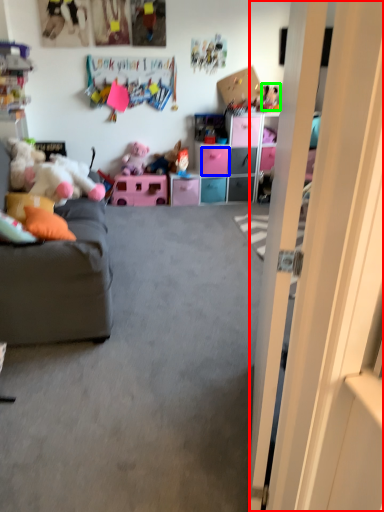
Question: Based on their relative distances, which object is nearer to door (highlighted by a red box)? Choose from drawer (highlighted by a blue box) and toy (highlighted by a green box).

Choices:
 (A) drawer
 (B) toy

Answer: (A)